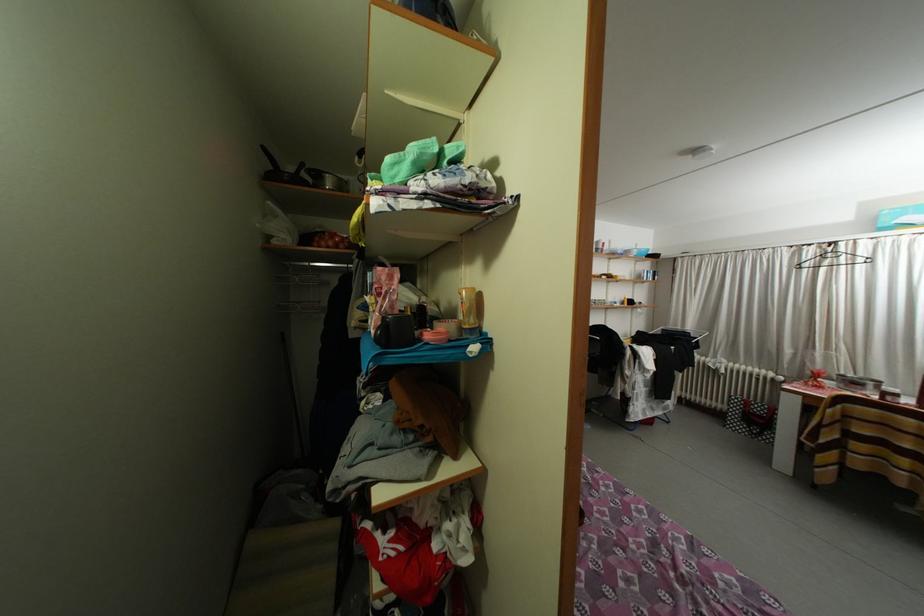
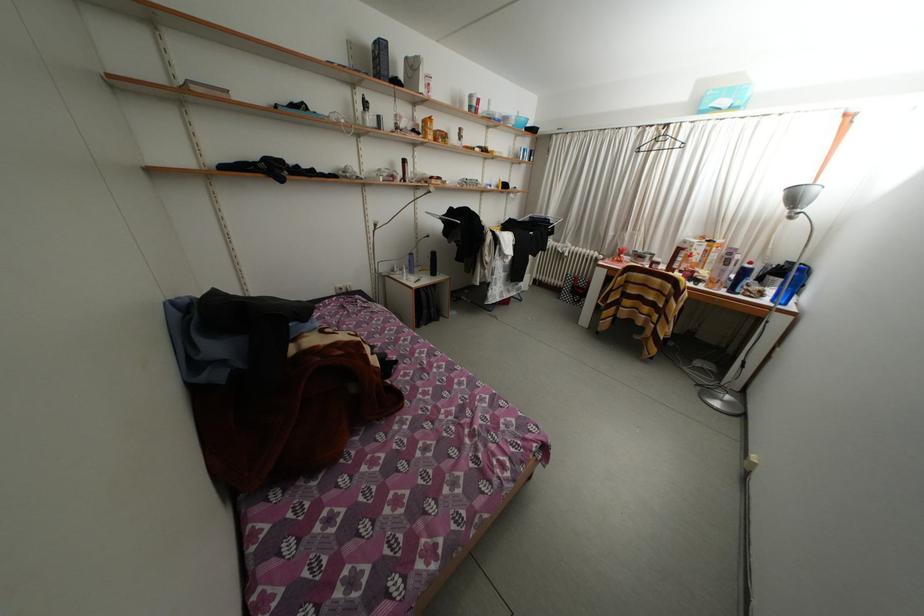
Based on the continuous images, in which direction is the camera rotating?

The camera's rotation is toward right-down.